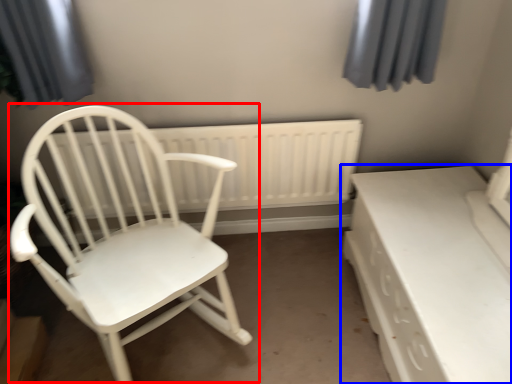
Question: Among these objects, which one is nearest to the camera, chair (highlighted by a red box) or table (highlighted by a blue box)?

Choices:
 (A) chair
 (B) table

Answer: (A)